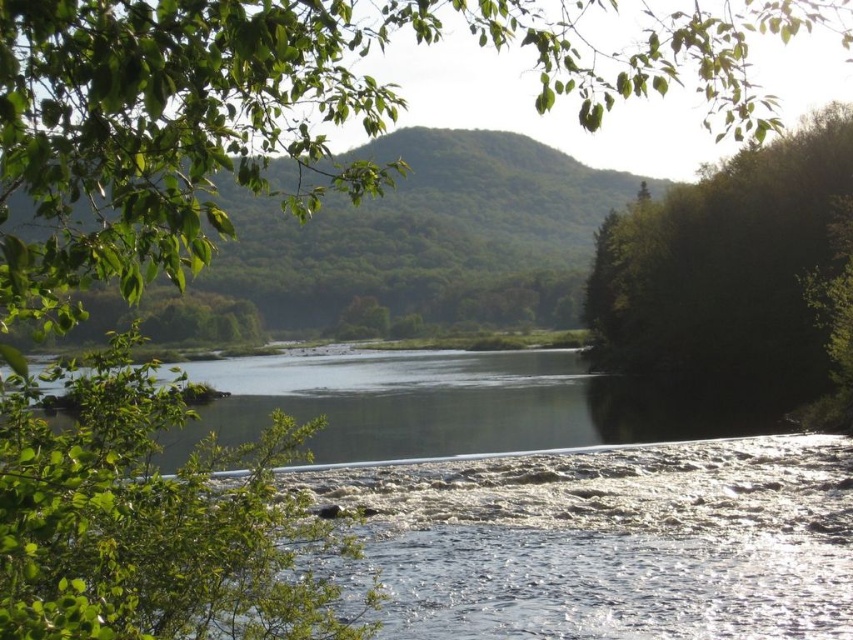
Does green leafy tree at upper left have a lesser width compared to green leafy tree at right?

No.

Who is taller, green leafy tree at upper left or green leafy tree at right?

With more height is green leafy tree at upper left.

Find the location of `green leafy tree at upper left`. green leafy tree at upper left is located at coordinates (286, 109).

The width and height of the screenshot is (853, 640). In order to click on green leafy tree at upper left in this screenshot , I will do `click(286, 109)`.